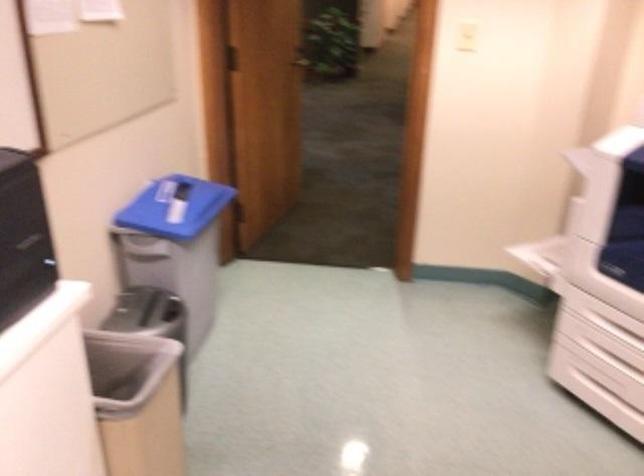
This screenshot has width=644, height=476. I want to click on recycling bin handle, so click(x=154, y=308).